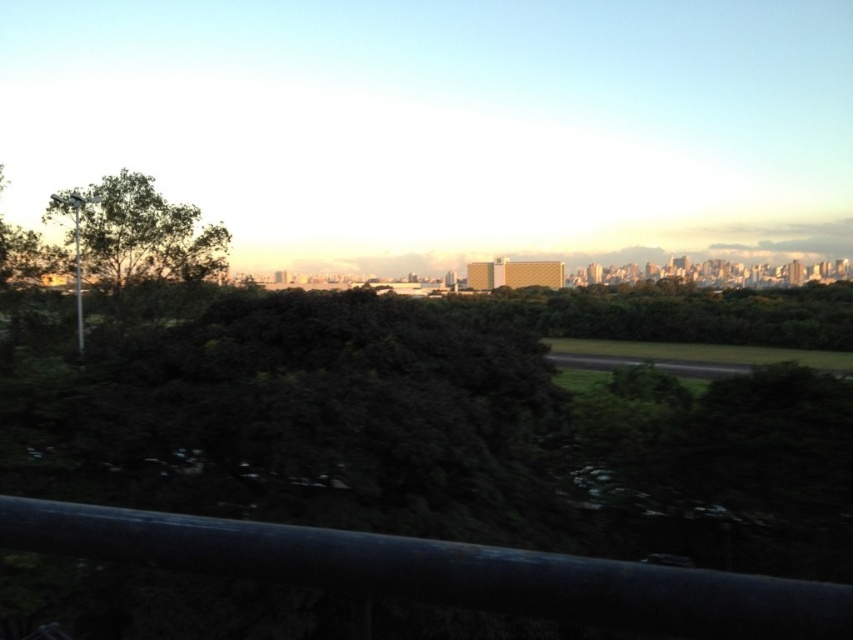
You are standing on the bridge and want to take a photo of the cityscape. The black metal rail at lower center and the green leafy tree at left are in your view. Which object should you move closer to in order to focus on the city in the background?

You should move closer to the green leafy tree at left because the black metal rail at lower center is in front of it, so moving closer to the tree would allow you to position yourself away from the rail and better frame the cityscape in the background.

You are standing on a bridge overlooking a city. You see the black metal rail at lower center and the green leafy tree at left. Which object is closer to your feet?

The black metal rail at lower center is closer to your feet because it is positioned below the green leafy tree at left.

You are standing on a bridge overlooking a city. You notice the black metal rail at lower center and the green leafy tree at left. Which object takes up more space in the image?

The green leafy tree at left takes up more space in the image than the black metal rail at lower center because the black metal rail at lower center occupies less space than green leafy tree at left.